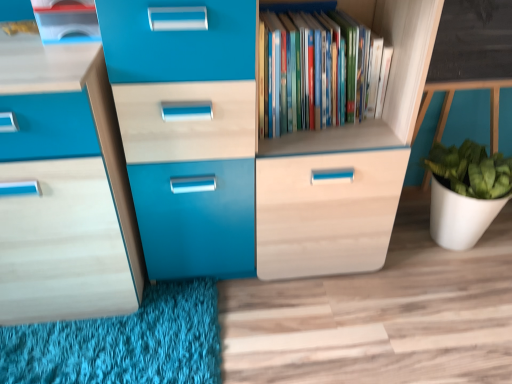
Question: Is matte plastic container at upper left looking in the opposite direction of wooden bookshelf at center?

Choices:
 (A) yes
 (B) no

Answer: (B)

Question: Considering the relative sizes of matte plastic container at upper left and wooden bookshelf at center in the image provided, is matte plastic container at upper left smaller than wooden bookshelf at center?

Choices:
 (A) no
 (B) yes

Answer: (B)

Question: Does matte plastic container at upper left have a lesser width compared to wooden bookshelf at center?

Choices:
 (A) no
 (B) yes

Answer: (A)

Question: Is matte plastic container at upper left not close to wooden bookshelf at center?

Choices:
 (A) no
 (B) yes

Answer: (A)

Question: Does matte plastic container at upper left lie in front of wooden bookshelf at center?

Choices:
 (A) no
 (B) yes

Answer: (B)

Question: Is matte plastic container at upper left shorter than wooden bookshelf at center?

Choices:
 (A) yes
 (B) no

Answer: (A)

Question: Would you say matte plastic container at upper left is part of wooden bookshelf at center's contents?

Choices:
 (A) yes
 (B) no

Answer: (B)

Question: From a real-world perspective, is wooden bookshelf at center under matte plastic container at upper left?

Choices:
 (A) yes
 (B) no

Answer: (A)

Question: From the image's perspective, is wooden bookshelf at center above matte plastic container at upper left?

Choices:
 (A) yes
 (B) no

Answer: (B)

Question: Is the depth of wooden bookshelf at center greater than that of matte plastic container at upper left?

Choices:
 (A) no
 (B) yes

Answer: (B)

Question: From the image's perspective, would you say wooden bookshelf at center is shown under matte plastic container at upper left?

Choices:
 (A) no
 (B) yes

Answer: (B)

Question: Is wooden bookshelf at center looking in the opposite direction of matte plastic container at upper left?

Choices:
 (A) yes
 (B) no

Answer: (B)

Question: From the image's perspective, is wooden bookshelf at center above or below matte plastic container at upper left?

Choices:
 (A) above
 (B) below

Answer: (B)